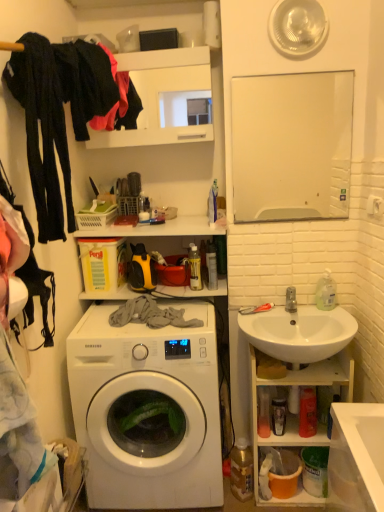
Question: Is white ceramic sink at right facing away from white glossy sink at lower right?

Choices:
 (A) no
 (B) yes

Answer: (A)

Question: Is white ceramic sink at right shorter than white glossy sink at lower right?

Choices:
 (A) yes
 (B) no

Answer: (A)

Question: Is white ceramic sink at right not near white glossy sink at lower right?

Choices:
 (A) yes
 (B) no

Answer: (B)

Question: Is white ceramic sink at right taller than white glossy sink at lower right?

Choices:
 (A) yes
 (B) no

Answer: (B)

Question: Is white ceramic sink at right wider than white glossy sink at lower right?

Choices:
 (A) yes
 (B) no

Answer: (A)

Question: Is white ceramic sink at right wider or thinner than silver metallic faucet at sink right?

Choices:
 (A) thin
 (B) wide

Answer: (B)

Question: Considering the relative positions of white ceramic sink at right and silver metallic faucet at sink right in the image provided, is white ceramic sink at right to the left or to the right of silver metallic faucet at sink right?

Choices:
 (A) left
 (B) right

Answer: (A)

Question: Choose the correct answer: Is white ceramic sink at right inside silver metallic faucet at sink right or outside it?

Choices:
 (A) inside
 (B) outside

Answer: (B)

Question: Is point (256, 325) closer or farther from the camera than point (291, 307)?

Choices:
 (A) farther
 (B) closer

Answer: (B)

Question: Considering the positions of white glossy sink at lower right and clear plastic bottle at right in the image, is white glossy sink at lower right wider or thinner than clear plastic bottle at right?

Choices:
 (A) wide
 (B) thin

Answer: (A)

Question: Looking at the image, does white glossy sink at lower right seem bigger or smaller compared to clear plastic bottle at right?

Choices:
 (A) big
 (B) small

Answer: (A)

Question: Is white glossy sink at lower right inside the boundaries of clear plastic bottle at right, or outside?

Choices:
 (A) inside
 (B) outside

Answer: (B)

Question: Is white glossy sink at lower right in front of or behind clear plastic bottle at right in the image?

Choices:
 (A) front
 (B) behind

Answer: (A)

Question: Visually, is white glossy mirror at upper center positioned to the left or to the right of black cotton pants at left, marked as the first clothing in a front-to-back arrangement?

Choices:
 (A) right
 (B) left

Answer: (A)

Question: In the image, is white glossy mirror at upper center positioned in front of or behind black cotton pants at left, placed as the second clothing when sorted from back to front?

Choices:
 (A) behind
 (B) front

Answer: (A)